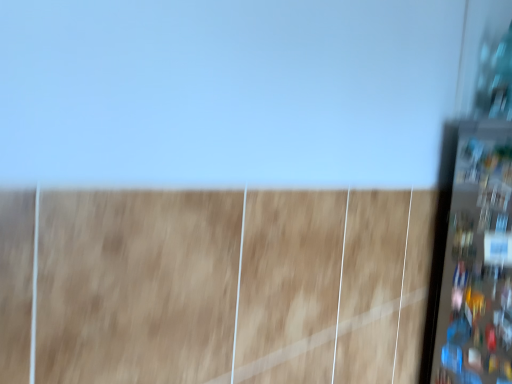
What do you see at coordinates (214, 286) in the screenshot?
I see `brown matte dirt field at center` at bounding box center [214, 286].

You are a GUI agent. You are given a task and a screenshot of the screen. Output one action in this format:
    pyautogui.click(x=<x>, y=<y>)
    Task: Click on the brown matte dirt field at center
    This screenshot has width=512, height=384.
    Given the screenshot: What is the action you would take?
    pyautogui.click(x=214, y=286)

Find the location of a particular element. brown matte dirt field at center is located at coordinates (214, 286).